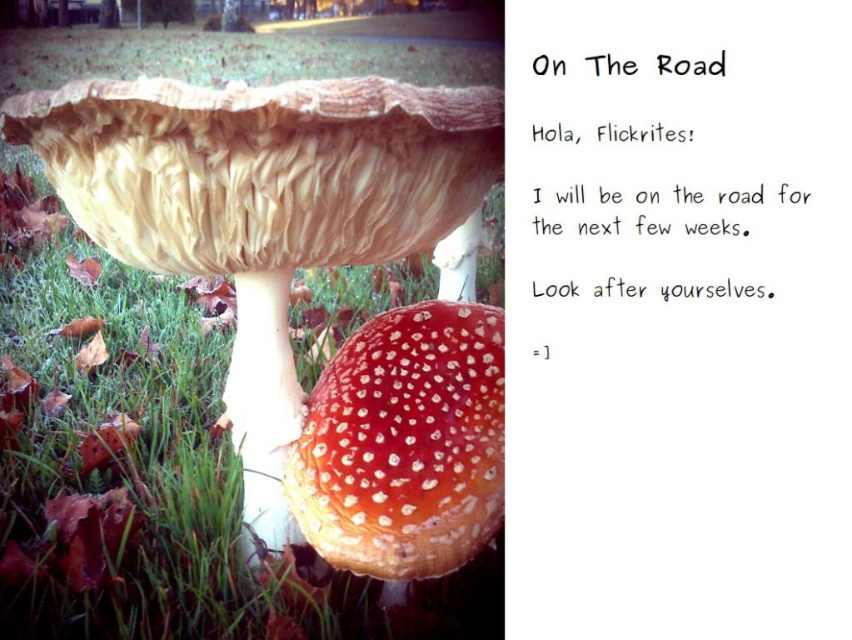
Question: Observing the image, what is the correct spatial positioning of green grass at lower left in reference to red matte mushroom at center?

Choices:
 (A) right
 (B) left

Answer: (B)

Question: Among these points, which one is farthest from the camera?

Choices:
 (A) (x=116, y=384)
 (B) (x=308, y=465)

Answer: (A)

Question: Which point is farther to the camera?

Choices:
 (A) red matte mushroom at center
 (B) green grass at lower left

Answer: (B)

Question: Is green grass at lower left to the left of red matte mushroom at center from the viewer's perspective?

Choices:
 (A) yes
 (B) no

Answer: (A)

Question: Is green grass at lower left above red matte mushroom at center?

Choices:
 (A) yes
 (B) no

Answer: (A)